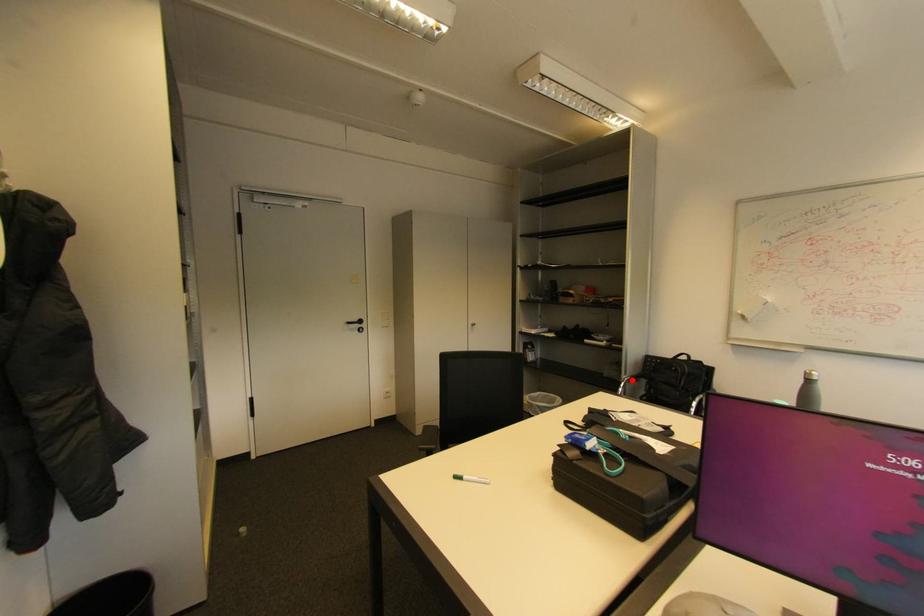
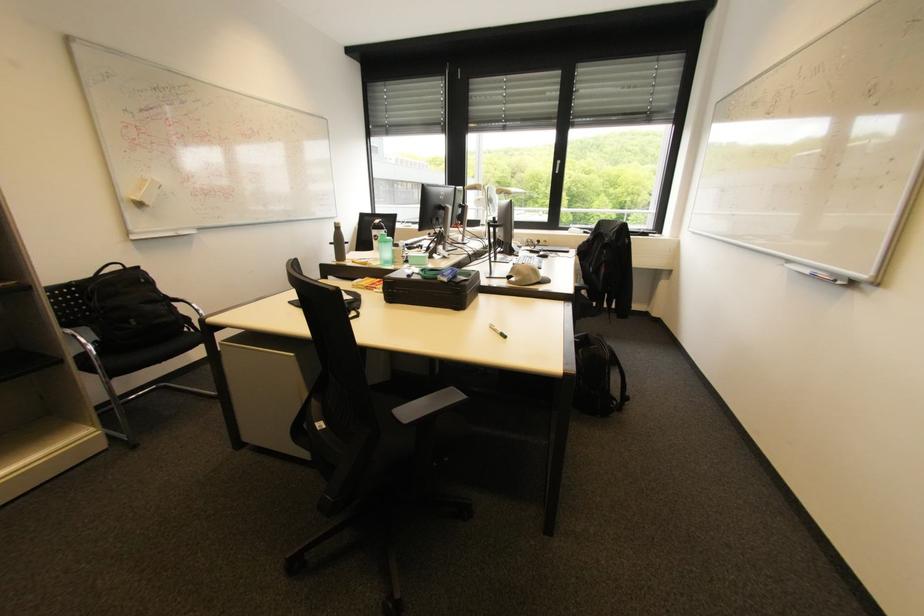
Question: I am providing you with two images of the same scene from different viewpoints. Image1 has a red point marked. In image2, the corresponding 3D location appears at what relative position? Reply with the corresponding letter.

Choices:
 (A) Closer
 (B) Farther

Answer: (B)